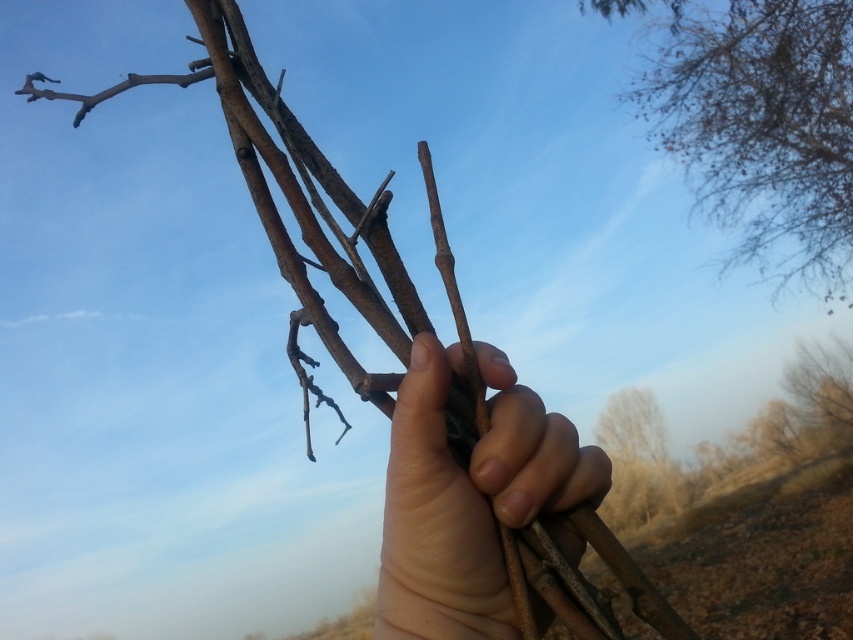
Which is above, bare branches at upper right or brown rough tree at lower right?

Positioned higher is bare branches at upper right.

Is bare branches at upper right closer to camera compared to brown rough tree at lower right?

Yes, it is.

Is point (840, 173) positioned in front of point (625, 417)?

That is True.

The height and width of the screenshot is (640, 853). What are the coordinates of `bare branches at upper right` in the screenshot? It's located at click(759, 125).

Which is more to the left, smooth brown hand at center or brown rough tree at lower right?

smooth brown hand at center

Is smooth brown hand at center to the left of brown rough tree at lower right from the viewer's perspective?

Yes, smooth brown hand at center is to the left of brown rough tree at lower right.

Find the location of a particular element. The width and height of the screenshot is (853, 640). smooth brown hand at center is located at coordinates (471, 499).

Can you confirm if bare branches at upper right is thinner than smooth brown hand at center?

No, bare branches at upper right is not thinner than smooth brown hand at center.

Find the location of `bare branches at upper right`. bare branches at upper right is located at coordinates (759, 125).

Which is behind, point (817, 19) or point (567, 538)?

The point (817, 19) is more distant.

Identify the location of bare branches at upper right. This screenshot has width=853, height=640. (759, 125).